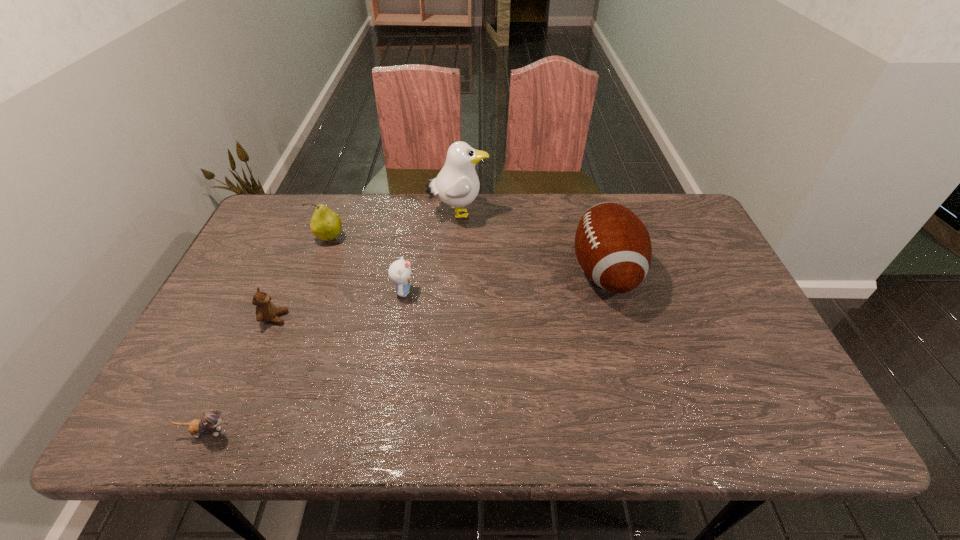
Locate an element on the screen. The width and height of the screenshot is (960, 540). free spot located on the beak of the second object from right to left is located at coordinates (544, 214).

Find the location of a particular element. Image resolution: width=960 pixels, height=540 pixels. free region located on the laces of the football is located at coordinates (435, 272).

Locate an element on the screen. vacant area situated on the laces of the football is located at coordinates (539, 272).

The width and height of the screenshot is (960, 540). Identify the location of vacant space located 0.140m on the laces of the football. 520,272.

Where is `free space located 0.150m on the right of the pear`? The height and width of the screenshot is (540, 960). free space located 0.150m on the right of the pear is located at coordinates (394, 238).

Where is `free space located 0.310m on the front-facing side of the right kitten`? free space located 0.310m on the front-facing side of the right kitten is located at coordinates (531, 292).

Identify the location of blank area located 0.130m at the face of the teddy bear. (338, 318).

Find the location of a particular element. vacant area situated 0.110m on the front-facing side of the nearer kitten is located at coordinates (286, 432).

Where is `gull that is at the far edge`? The image size is (960, 540). gull that is at the far edge is located at coordinates (457, 184).

Locate an element on the screen. Image resolution: width=960 pixels, height=540 pixels. football at the far edge is located at coordinates (613, 247).